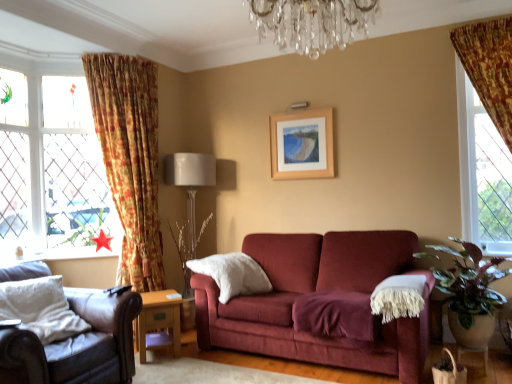
Question: Is wooden side table at lower center aimed at leather armchair at lower left?

Choices:
 (A) yes
 (B) no

Answer: (B)

Question: Is there a large distance between wooden side table at lower center and leather armchair at lower left?

Choices:
 (A) no
 (B) yes

Answer: (A)

Question: Does wooden side table at lower center touch leather armchair at lower left?

Choices:
 (A) no
 (B) yes

Answer: (A)

Question: Considering the relative sizes of wooden side table at lower center and leather armchair at lower left in the image provided, is wooden side table at lower center wider than leather armchair at lower left?

Choices:
 (A) no
 (B) yes

Answer: (A)

Question: Does wooden side table at lower center have a lesser width compared to leather armchair at lower left?

Choices:
 (A) no
 (B) yes

Answer: (B)

Question: Does wooden side table at lower center appear on the right side of leather armchair at lower left?

Choices:
 (A) yes
 (B) no

Answer: (A)

Question: Is wooden side table at lower center taller than crystal chandelier at upper center?

Choices:
 (A) yes
 (B) no

Answer: (A)

Question: Does wooden side table at lower center lie behind crystal chandelier at upper center?

Choices:
 (A) no
 (B) yes

Answer: (B)

Question: From the image's perspective, would you say wooden side table at lower center is shown under crystal chandelier at upper center?

Choices:
 (A) no
 (B) yes

Answer: (B)

Question: Does wooden side table at lower center have a larger size compared to crystal chandelier at upper center?

Choices:
 (A) no
 (B) yes

Answer: (A)

Question: Is wooden side table at lower center thinner than crystal chandelier at upper center?

Choices:
 (A) no
 (B) yes

Answer: (B)

Question: From the image's perspective, is wooden side table at lower center on crystal chandelier at upper center?

Choices:
 (A) yes
 (B) no

Answer: (B)

Question: Can you confirm if green leafy plant at right is taller than wooden picture frame at upper center?

Choices:
 (A) no
 (B) yes

Answer: (B)